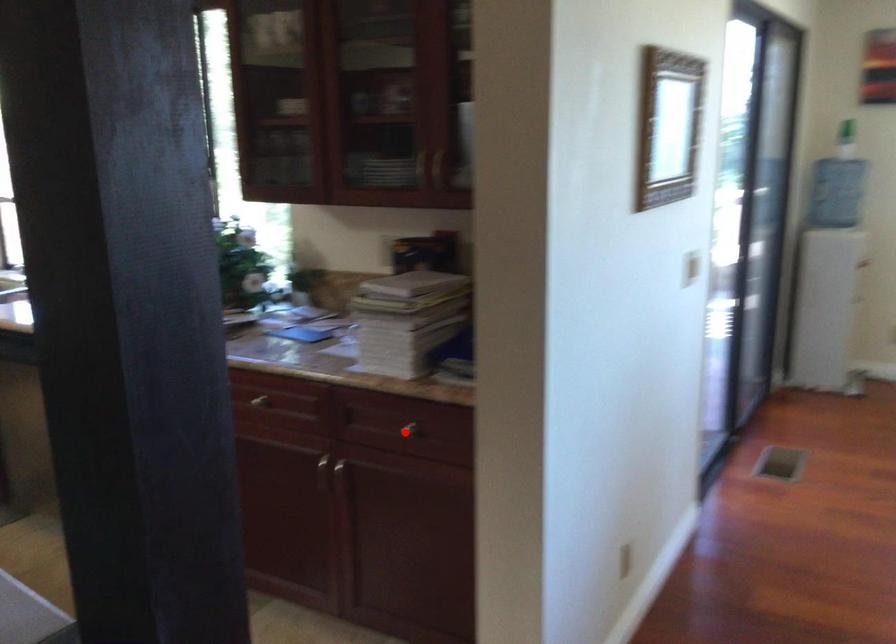
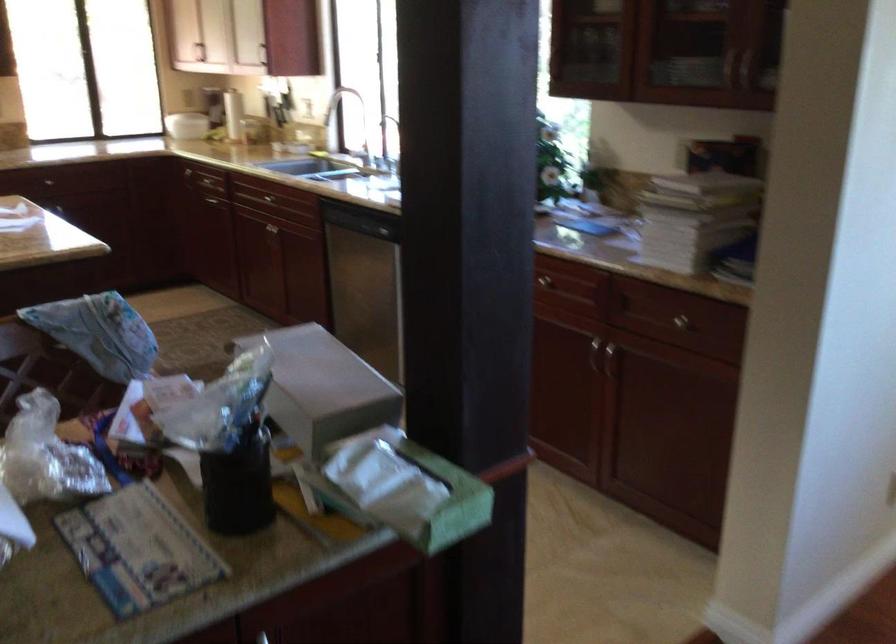
Locate, in the second image, the point that corresponds to the highlighted location in the first image.

(682, 323)